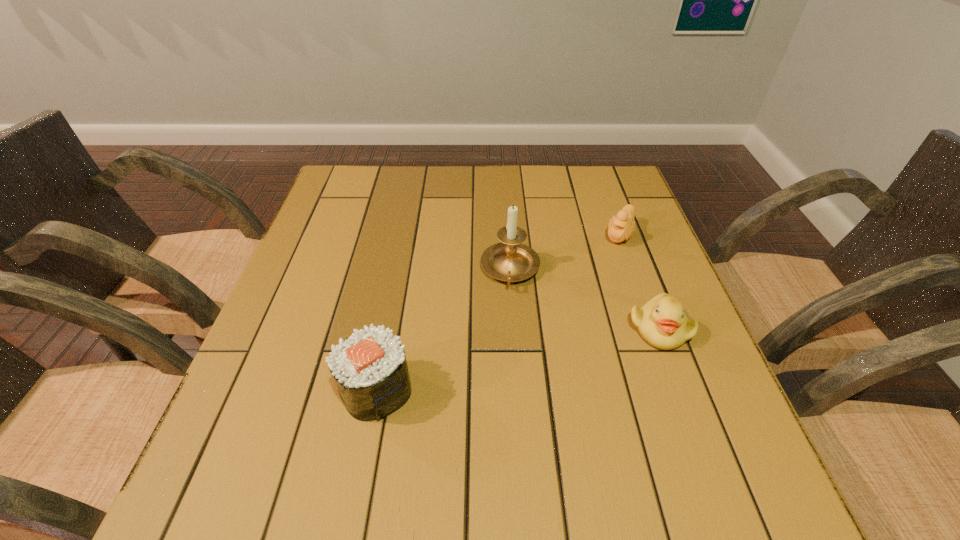
Locate an element on the screen. The width and height of the screenshot is (960, 540). blank region between the farther duckling and the nearer duckling is located at coordinates (639, 281).

You are a GUI agent. You are given a task and a screenshot of the screen. Output one action in this format:
    pyautogui.click(x=<x>, y=<y>)
    Task: Click on the free space between the farther duckling and the leftmost object
    The image size is (960, 540).
    Given the screenshot: What is the action you would take?
    pyautogui.click(x=498, y=312)

Locate an element on the screen. vacant space that is in between the farther duckling and the tallest object is located at coordinates (564, 252).

Image resolution: width=960 pixels, height=540 pixels. I want to click on free space between the second nearest object and the farther duckling, so click(639, 281).

The height and width of the screenshot is (540, 960). Identify the location of vacant space in between the second object from left to right and the nearer duckling. (585, 299).

Where is `free space between the second nearest object and the farther duckling`? The height and width of the screenshot is (540, 960). free space between the second nearest object and the farther duckling is located at coordinates (639, 281).

At what (x,y) coordinates should I click in order to perform the action: click on free space between the farther duckling and the nearer duckling. Please return your answer as a coordinate pair (x, y). Image resolution: width=960 pixels, height=540 pixels. Looking at the image, I should click on (639, 281).

I want to click on free space between the second nearest object and the leftmost object, so click(518, 359).

The height and width of the screenshot is (540, 960). Find the location of `unoccupied position between the third farthest object and the candle holder`. unoccupied position between the third farthest object and the candle holder is located at coordinates (585, 299).

I want to click on vacant space that's between the leftmost object and the tallest object, so click(444, 329).